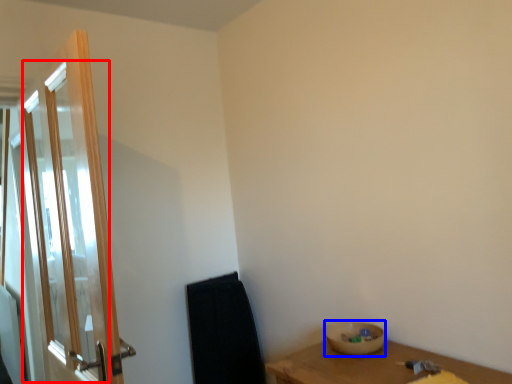
Question: Which of the following is the farthest to the observer, screen door (highlighted by a red box) or basin (highlighted by a blue box)?

Choices:
 (A) screen door
 (B) basin

Answer: (B)